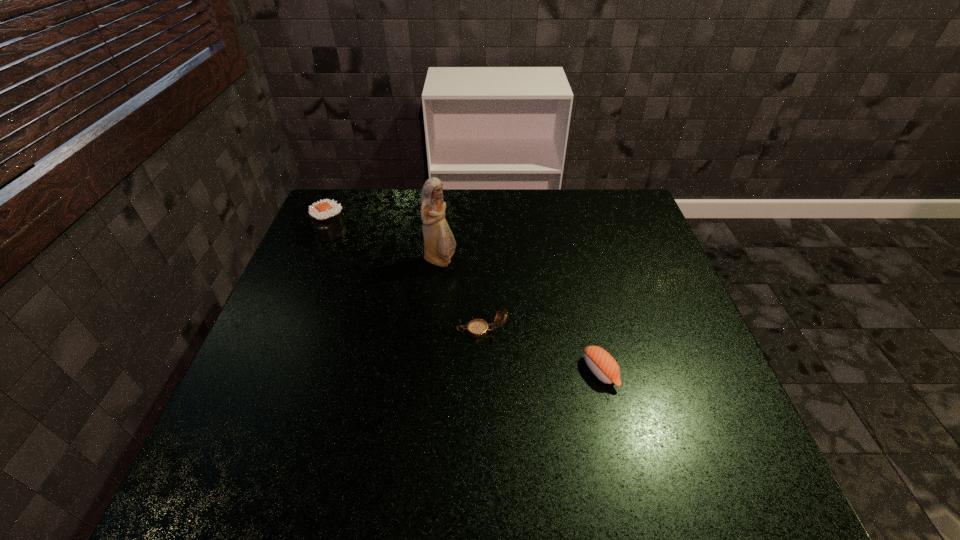
The height and width of the screenshot is (540, 960). In order to click on free space between the left sushi and the compass in this screenshot , I will do `click(407, 281)`.

Image resolution: width=960 pixels, height=540 pixels. In order to click on free area in between the figurine and the nearer sushi in this screenshot , I will do `click(520, 316)`.

Where is `the second closest object relative to the third farthest object`? The height and width of the screenshot is (540, 960). the second closest object relative to the third farthest object is located at coordinates [x=439, y=243].

Identify which object is the closest to the shortest object. Please provide its 2D coordinates. Your answer should be formatted as a tuple, i.e. [(x, y)], where the tuple contains the x and y coordinates of a point satisfying the conditions above.

[(477, 328)]

Find the location of a particular element. This screenshot has height=540, width=960. free point that satisfies the following two spatial constraints: 1. on the front-facing side of the tallest object; 2. on the left side of the right sushi is located at coordinates click(x=429, y=372).

What are the coordinates of `free space that satisfies the following two spatial constraints: 1. on the back side of the rightmost object; 2. on the front-facing side of the tallest object` in the screenshot? It's located at (574, 261).